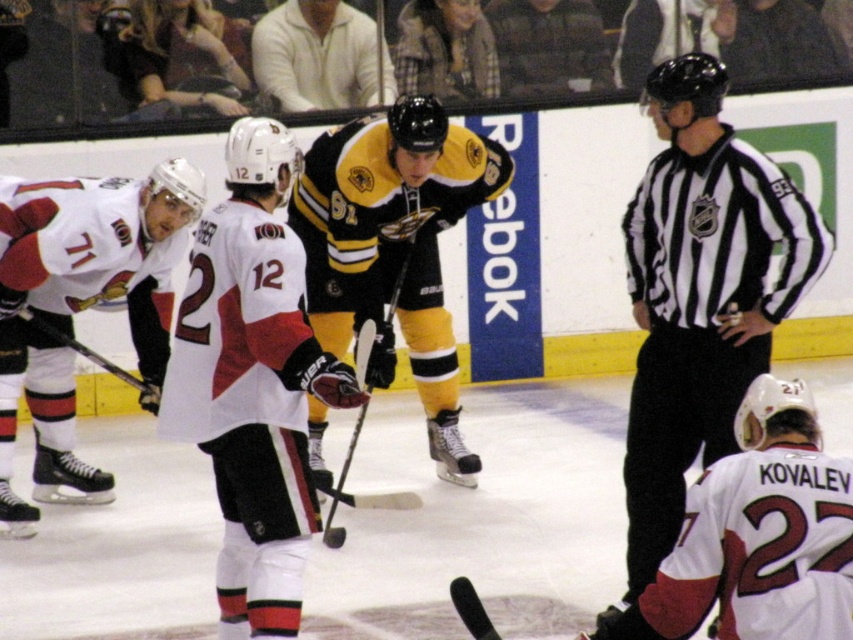
You are a referee observing the ice hockey game. You notice two players wearing black matte jersey at center and white matte jersey at left. Which player has a wider jersey?

The black matte jersey at center has a larger width than the white matte jersey at left, so the player wearing the black matte jersey at center has a wider jersey.

You are a referee standing at the edge of the ice rink. You need to locate the black and white striped shirt at center to ensure proper positioning for the next play. Based on the coordinates provided, where exactly should you direct your team to place the shirt?

The black and white striped shirt at center should be placed at coordinates point (700,296) as specified in the description to ensure correct positioning for the next play.

You are a referee observing an ice hockey game. You notice two items at the center of the rink. One is the black and white striped shirt at center and the other is the black matte hockey stick at center. Which item has a larger width?

The black and white striped shirt at center might be wider than black matte hockey stick at center according to the description provided.